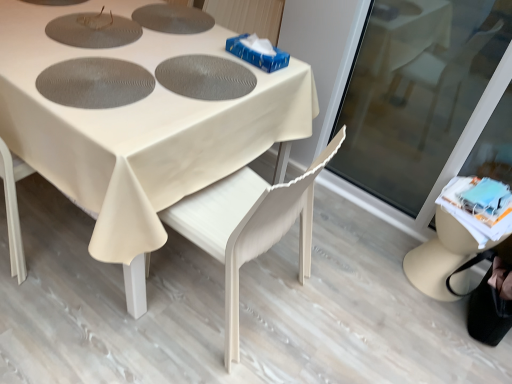
In order to click on vacant space in front of transparent glass screen door at lower right in this screenshot , I will do `click(383, 306)`.